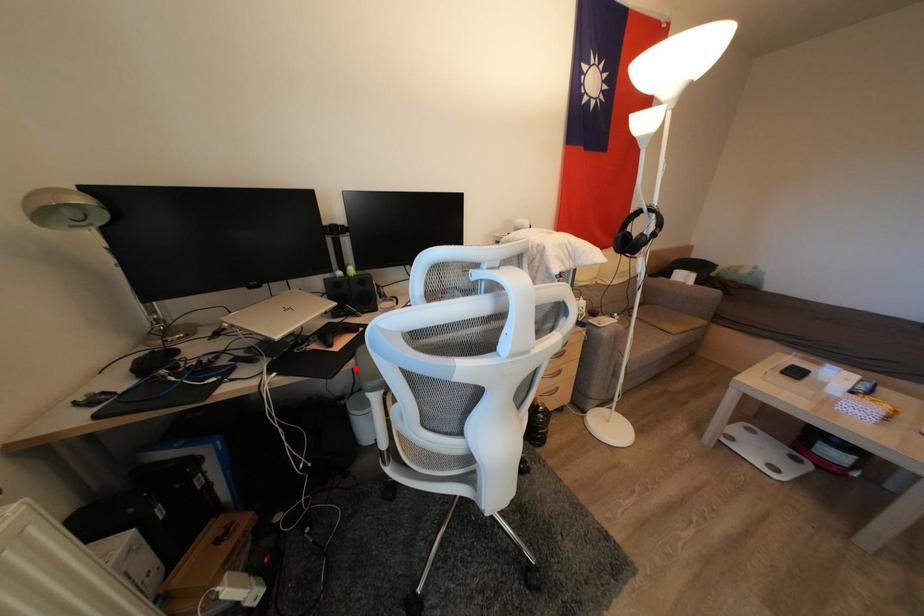
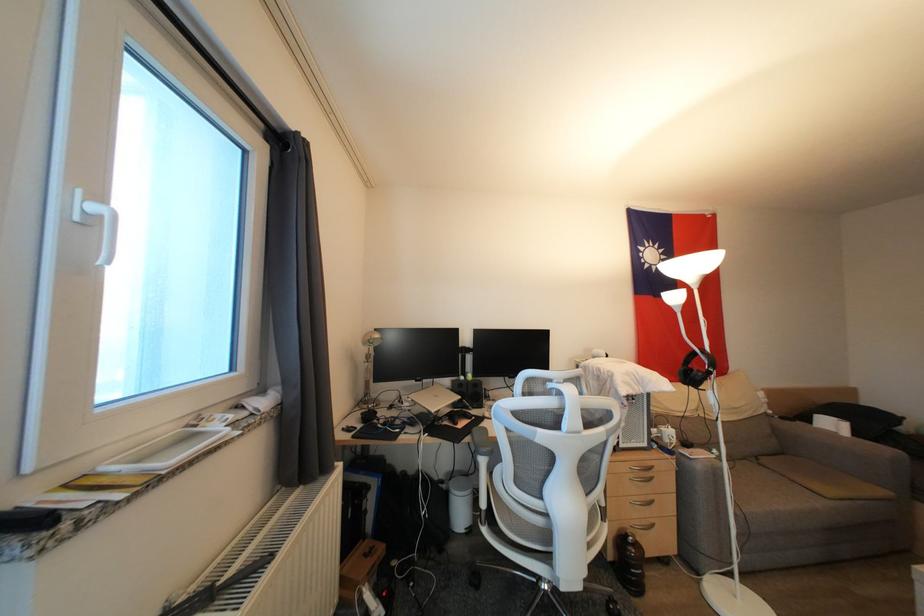
Question: I am providing you with two images of the same scene from different viewpoints. Given a red point in image1, look at the same physical point in image2. Is it:

Choices:
 (A) Closer to the viewpoint
 (B) Farther from the viewpoint

Answer: (A)